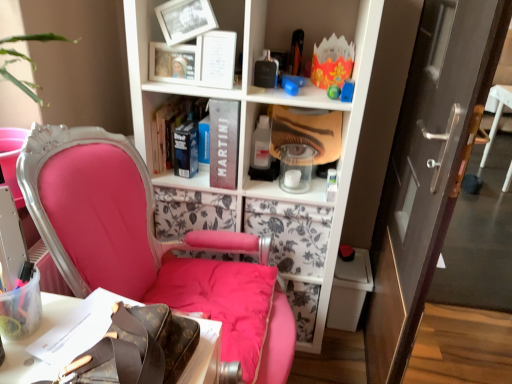
The height and width of the screenshot is (384, 512). What do you see at coordinates (254, 190) in the screenshot?
I see `matte plastic mask at upper center` at bounding box center [254, 190].

In order to face matte pink chair at left, should I rotate leftwards or rightwards?

It's best to rotate left around 10.282 degrees.

Locate an element on the screen. Image resolution: width=512 pixels, height=384 pixels. matte black book at center, the 1th book in the right-to-left sequence is located at coordinates (224, 143).

This screenshot has height=384, width=512. I want to click on matte brown door at right, so click(x=428, y=168).

From the image's perspective, who appears lower, brown leather bag at lower left or matte black book at center, which is counted as the second book, starting from the left?

brown leather bag at lower left appears lower in the image.

Is brown leather bag at lower left inside or outside of matte black book at center, which is counted as the second book, starting from the left?

The correct answer is: outside.

Is brown leather bag at lower left wider than matte black book at center, the 1th book in the right-to-left sequence?

Correct, the width of brown leather bag at lower left exceeds that of matte black book at center, the 1th book in the right-to-left sequence.

Would you consider brown leather bag at lower left to be distant from matte black book at center, the 1th book in the right-to-left sequence?

No, brown leather bag at lower left is in close proximity to matte black book at center, the 1th book in the right-to-left sequence.

Can you confirm if hardcover book at center, which is counted as the second book, starting from the right, is taller than matte black book at center, the 1th book in the right-to-left sequence?

No.

Is hardcover book at center, which ranks as the first book in left-to-right order, bigger than matte black book at center, the 1th book in the right-to-left sequence?

Actually, hardcover book at center, which ranks as the first book in left-to-right order, might be smaller than matte black book at center, the 1th book in the right-to-left sequence.

Which object is further away from the camera taking this photo, hardcover book at center, which ranks as the first book in left-to-right order, or matte black book at center, the 1th book in the right-to-left sequence?

hardcover book at center, which ranks as the first book in left-to-right order, is more distant.

From a real-world perspective, is hardcover book at center, which ranks as the first book in left-to-right order, positioned over matte black book at center, the 1th book in the right-to-left sequence, based on gravity?

No.

Is matte black book at center, the 1th book in the right-to-left sequence, taller than hardcover book at center, which is counted as the second book, starting from the right?

Correct, matte black book at center, the 1th book in the right-to-left sequence, is much taller as hardcover book at center, which is counted as the second book, starting from the right.

Locate an element on the screen. Image resolution: width=512 pixels, height=384 pixels. book on the right of hardcover book at center, which ranks as the first book in left-to-right order is located at coordinates (224, 143).

Are matte black book at center, the 1th book in the right-to-left sequence, and hardcover book at center, which is counted as the second book, starting from the right, far apart?

No, there isn't a large distance between matte black book at center, the 1th book in the right-to-left sequence, and hardcover book at center, which is counted as the second book, starting from the right.

Is hardcover book at center, which is counted as the second book, starting from the right, surrounded by matte black book at center, which is counted as the second book, starting from the left?

No.

In the image, is matte black book at center, which is counted as the second book, starting from the left, positioned in front of or behind matte plastic mask at upper center?

Clearly, matte black book at center, which is counted as the second book, starting from the left, is in front of matte plastic mask at upper center.

Considering the relative positions of matte black book at center, the 1th book in the right-to-left sequence, and matte plastic mask at upper center in the image provided, is matte black book at center, the 1th book in the right-to-left sequence, to the left or to the right of matte plastic mask at upper center?

In the image, matte black book at center, the 1th book in the right-to-left sequence, appears on the left side of matte plastic mask at upper center.

Looking at their sizes, would you say matte black book at center, which is counted as the second book, starting from the left, is wider or thinner than matte plastic mask at upper center?

In the image, matte black book at center, which is counted as the second book, starting from the left, appears to be wider than matte plastic mask at upper center.

Can we say matte black book at center, the 1th book in the right-to-left sequence, lies outside brown leather bag at lower left?

Yes, matte black book at center, the 1th book in the right-to-left sequence, is located beyond the bounds of brown leather bag at lower left.

Which of these two, matte black book at center, the 1th book in the right-to-left sequence, or brown leather bag at lower left, is wider?

With larger width is brown leather bag at lower left.

Can you confirm if matte black book at center, the 1th book in the right-to-left sequence, is taller than brown leather bag at lower left?

Indeed, matte black book at center, the 1th book in the right-to-left sequence, has a greater height compared to brown leather bag at lower left.

Considering the positions of objects hardcover book at center, which ranks as the first book in left-to-right order, and matte brown door at right in the image provided, who is behind, hardcover book at center, which ranks as the first book in left-to-right order, or matte brown door at right?

hardcover book at center, which ranks as the first book in left-to-right order, is further from the camera.

Are hardcover book at center, which is counted as the second book, starting from the right, and matte brown door at right located far from each other?

No, hardcover book at center, which is counted as the second book, starting from the right, is not far away from matte brown door at right.

Is hardcover book at center, which is counted as the second book, starting from the right, oriented away from matte brown door at right?

hardcover book at center, which is counted as the second book, starting from the right, is not turned away from matte brown door at right.

Can you tell me how much hardcover book at center, which ranks as the first book in left-to-right order, and matte brown door at right differ in facing direction?

There is a 1.26-degree angle between the facing directions of hardcover book at center, which ranks as the first book in left-to-right order, and matte brown door at right.

Could you tell me if matte brown door at right is facing matte pink chair at left?

No, matte brown door at right is not turned towards matte pink chair at left.

Is matte brown door at right outside of matte pink chair at left?

Yes, matte brown door at right is not within matte pink chair at left.

Can you tell me how much matte brown door at right and matte pink chair at left differ in facing direction?

matte brown door at right and matte pink chair at left are facing 94.5 degrees away from each other.

Locate an element on the screen. This screenshot has width=512, height=384. door on the right of matte pink chair at left is located at coordinates (428, 168).

The height and width of the screenshot is (384, 512). There is a brown leather bag at lower left. In order to click on the 2nd book above it (from a real-world perspective) in this screenshot , I will do `click(224, 143)`.

Where is `book above the matte black book at center, the 1th book in the right-to-left sequence (from the image's perspective)`? Image resolution: width=512 pixels, height=384 pixels. book above the matte black book at center, the 1th book in the right-to-left sequence (from the image's perspective) is located at coordinates (172, 127).

Based on their spatial positions, is brown leather bag at lower left or matte plastic mask at upper center further from matte black book at center, the 1th book in the right-to-left sequence?

The object further to matte black book at center, the 1th book in the right-to-left sequence, is brown leather bag at lower left.

Estimate the real-world distances between objects in this image. Which object is closer to brown leather bag at lower left, hardcover book at center, which ranks as the first book in left-to-right order, or matte black book at center, the 1th book in the right-to-left sequence?

The object closer to brown leather bag at lower left is matte black book at center, the 1th book in the right-to-left sequence.

Considering their positions, is matte plastic mask at upper center positioned further to brown leather bag at lower left than hardcover book at center, which ranks as the first book in left-to-right order?

hardcover book at center, which ranks as the first book in left-to-right order, is further to brown leather bag at lower left.

Consider the image. Considering their positions, is brown leather bag at lower left positioned further to matte pink chair at left than matte black book at center, the 1th book in the right-to-left sequence?

matte black book at center, the 1th book in the right-to-left sequence, is positioned further to the anchor matte pink chair at left.

Which object lies nearer to the anchor point matte brown door at right, matte plastic mask at upper center or matte pink chair at left?

matte plastic mask at upper center is positioned closer to the anchor matte brown door at right.

When comparing their distances from brown leather bag at lower left, does matte black book at center, the 1th book in the right-to-left sequence, or hardcover book at center, which ranks as the first book in left-to-right order, seem further?

hardcover book at center, which ranks as the first book in left-to-right order.

Estimate the real-world distances between objects in this image. Which object is closer to matte plastic mask at upper center, brown leather bag at lower left or matte black book at center, which is counted as the second book, starting from the left?

matte black book at center, which is counted as the second book, starting from the left, is positioned closer to the anchor matte plastic mask at upper center.

Based on their spatial positions, is brown leather bag at lower left or matte black book at center, which is counted as the second book, starting from the left, further from hardcover book at center, which is counted as the second book, starting from the right?

brown leather bag at lower left lies further to hardcover book at center, which is counted as the second book, starting from the right, than the other object.

In order to click on chair positioned between brown leather bag at lower left and matte plastic mask at upper center from near to far in this screenshot , I will do `click(143, 241)`.

What are the coordinates of `book located between hardcover book at center, which ranks as the first book in left-to-right order, and matte brown door at right in the left-right direction` in the screenshot? It's located at (224, 143).

Locate an element on the screen. The height and width of the screenshot is (384, 512). chair situated between hardcover book at center, which ranks as the first book in left-to-right order, and matte brown door at right from left to right is located at coordinates (143, 241).

Locate an element on the screen. cabinet between matte pink chair at left and hardcover book at center, which is counted as the second book, starting from the right, from front to back is located at coordinates (254, 190).